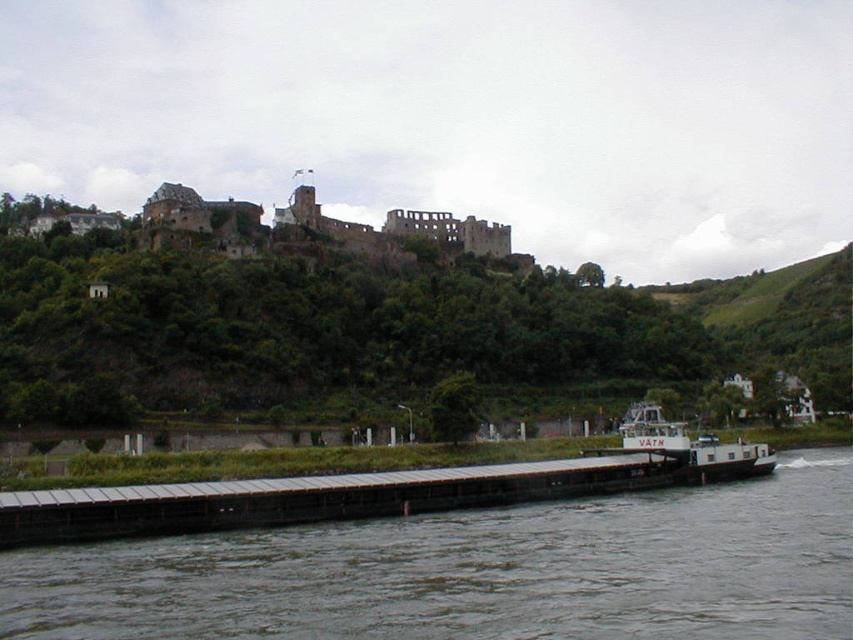
Question: Is brown wooden dock at lower center thinner than metallic gray dock at lower center?

Choices:
 (A) no
 (B) yes

Answer: (A)

Question: Which point appears farthest from the camera in this image?

Choices:
 (A) (701, 436)
 (B) (28, 630)

Answer: (A)

Question: Can you confirm if brown wooden dock at lower center is positioned to the left of metallic gray dock at lower center?

Choices:
 (A) no
 (B) yes

Answer: (A)

Question: Which of the following is the farthest from the observer?

Choices:
 (A) (247, 477)
 (B) (94, 605)

Answer: (A)

Question: Can you confirm if brown wooden dock at lower center is bigger than metallic gray dock at lower center?

Choices:
 (A) no
 (B) yes

Answer: (B)